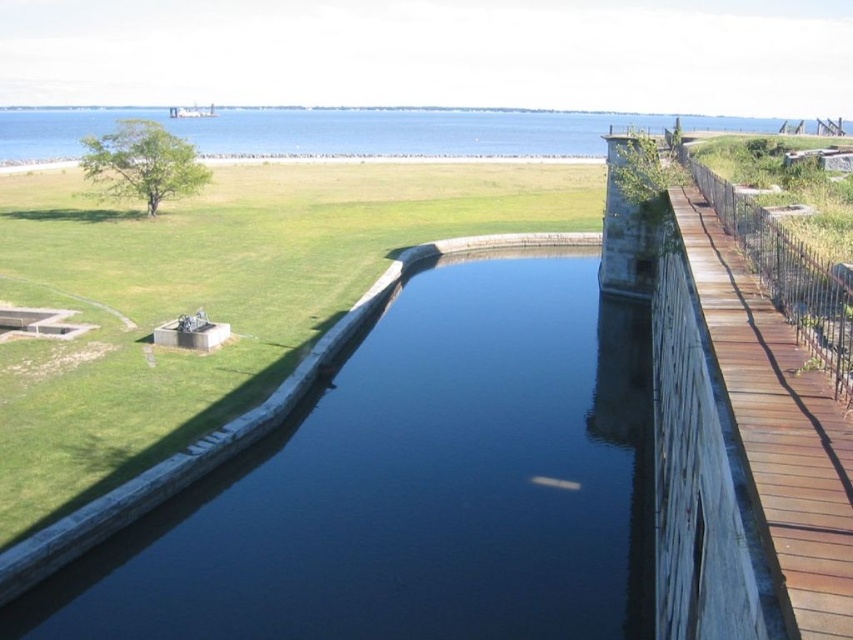
Is wooden walkway at right closer to camera compared to brown wooden rail at right?

Yes, wooden walkway at right is in front of brown wooden rail at right.

Does wooden walkway at right appear on the right side of brown wooden rail at right?

Incorrect, wooden walkway at right is not on the right side of brown wooden rail at right.

Does point (762, 509) come in front of point (840, 292)?

Yes, it is.

Identify the location of wooden walkway at right. (778, 426).

Between point (138, 611) and point (506, 147), which one is positioned behind?

Point (506, 147)

Is dark stone canal at center above blue water at center?

No.

Is point (456, 310) behind point (228, 154)?

No, it is in front of (228, 154).

Where is `dark stone canal at center`? This screenshot has height=640, width=853. dark stone canal at center is located at coordinates (413, 486).

Does dark stone canal at center have a larger size compared to wooden walkway at right?

Indeed, dark stone canal at center has a larger size compared to wooden walkway at right.

Who is more forward, [374,500] or [747,305]?

Point [747,305] is more forward.

Which is in front, point (171, 579) or point (712, 256)?

Point (712, 256) is in front.

Find the location of a particular element. The height and width of the screenshot is (640, 853). dark stone canal at center is located at coordinates (413, 486).